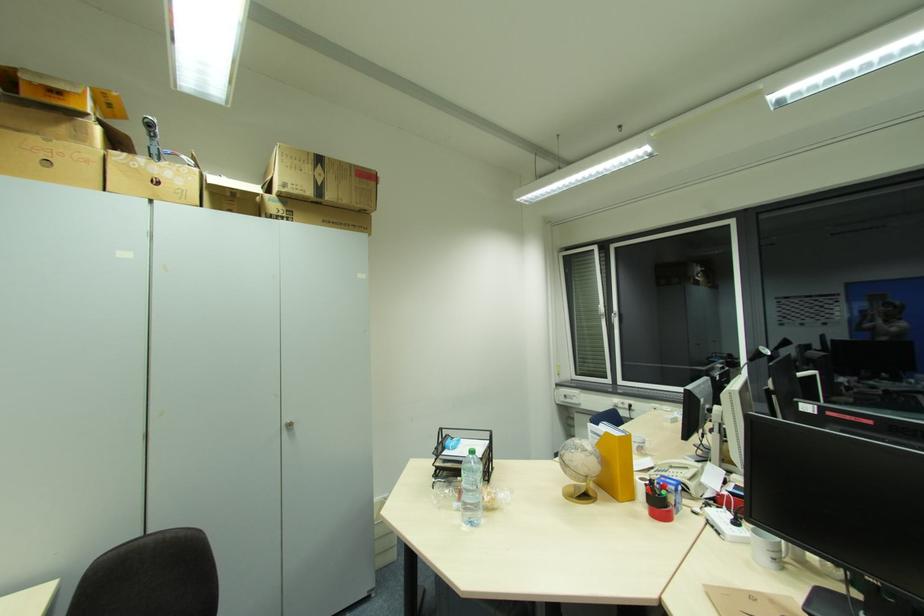
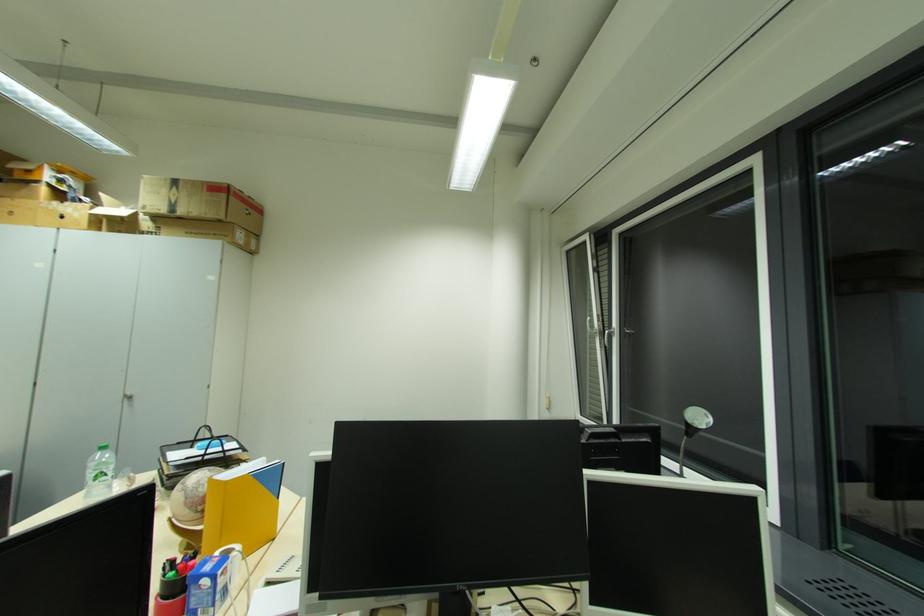
The point at (286, 430) is marked in the first image. Where is the corresponding point in the second image?

(128, 400)